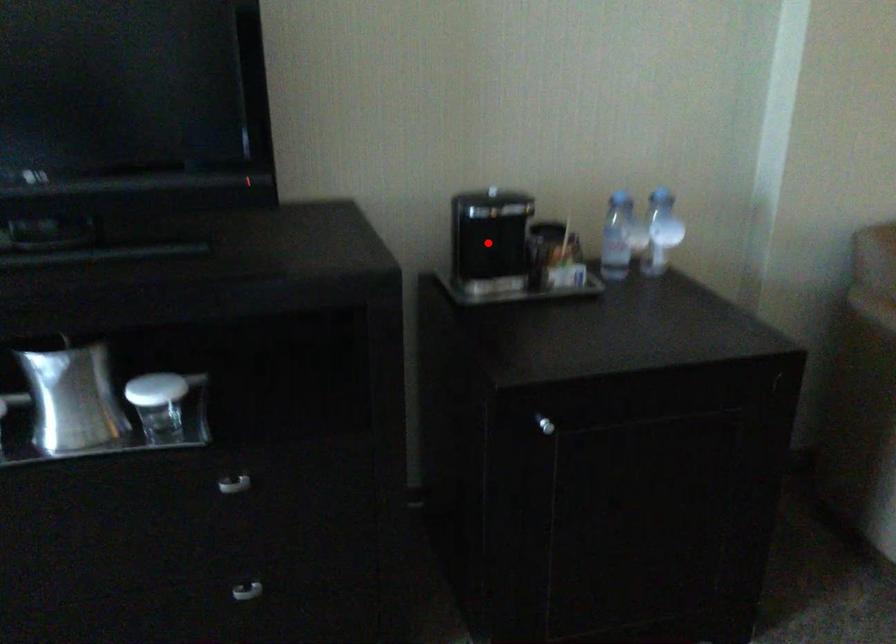
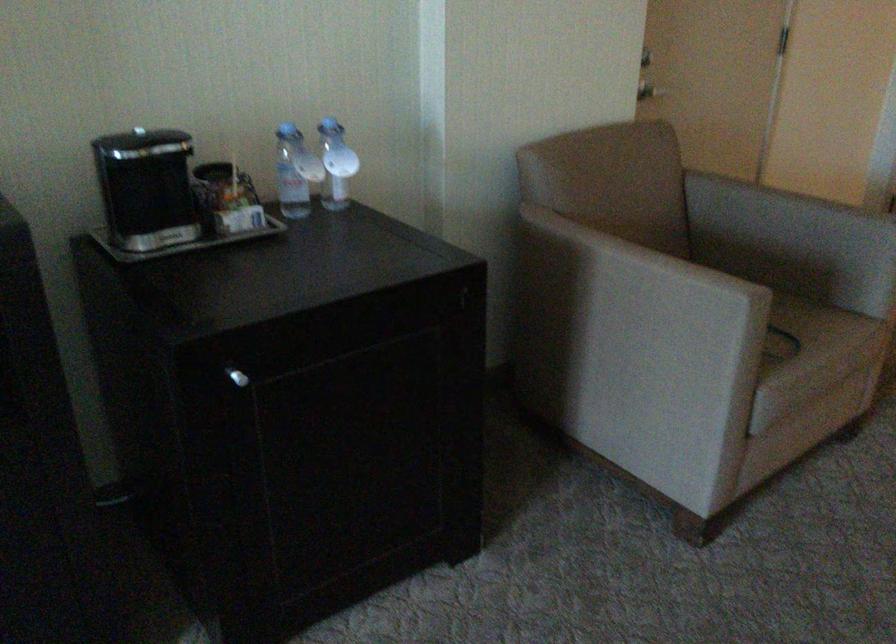
Find the pixel in the second image that matches the highlighted location in the first image.

(149, 194)